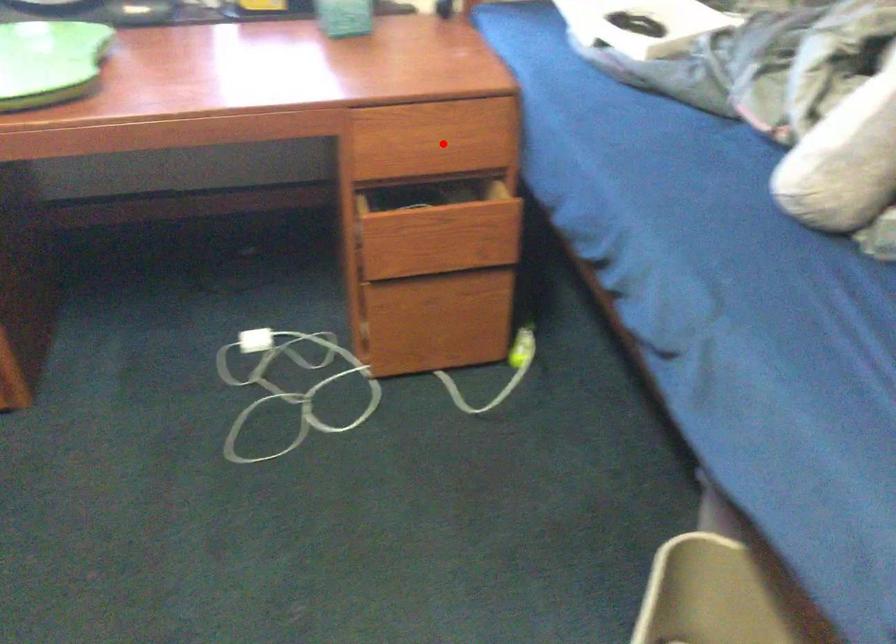
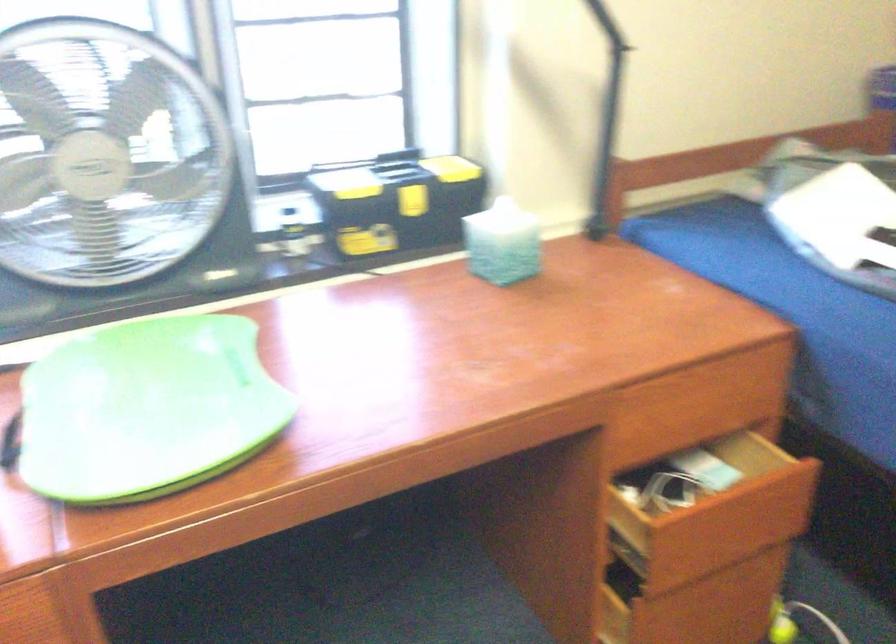
In the second image, find the point that corresponds to the highlighted location in the first image.

(693, 415)